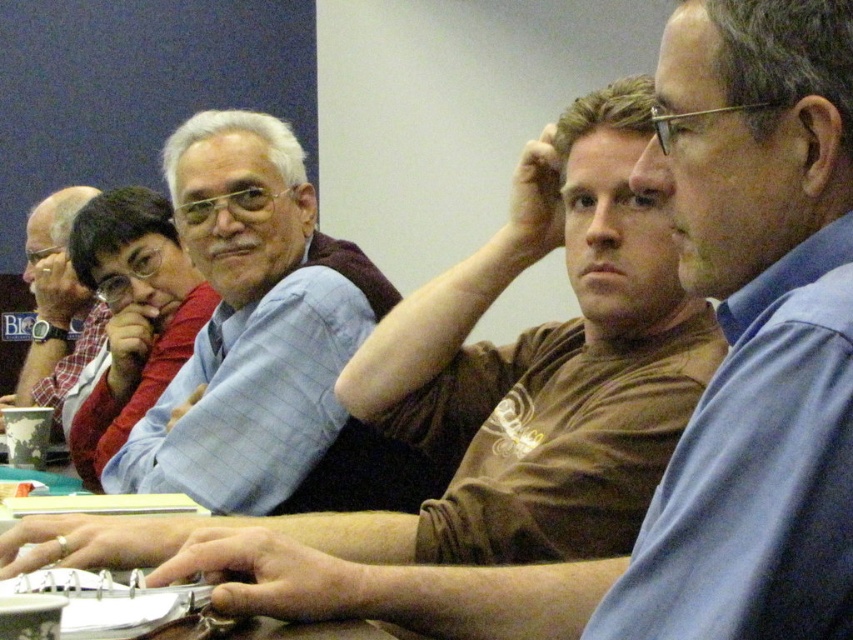
You are standing in front of the conference table and want to place a small object on the table. You have two points marked on the table surface at coordinates point (97, 438) and point (115, 563). Which point is closer to you?

Point (97, 438) is closer to you because it is further to the camera than point (115, 563).

Based on the photo, you are organizing a small event and need to place a decorative vase on the brown leather table at center. Considering the height of the matte red sweater at center, will the vase be visible from above the table?

The matte red sweater at center is much taller than the brown leather table at center, so the vase placed on the brown leather table at center will be obscured by the sweater.

What object is located at the coordinate point (190,532) in the image?

The brown leather table at center is located at the coordinate point (190,532).